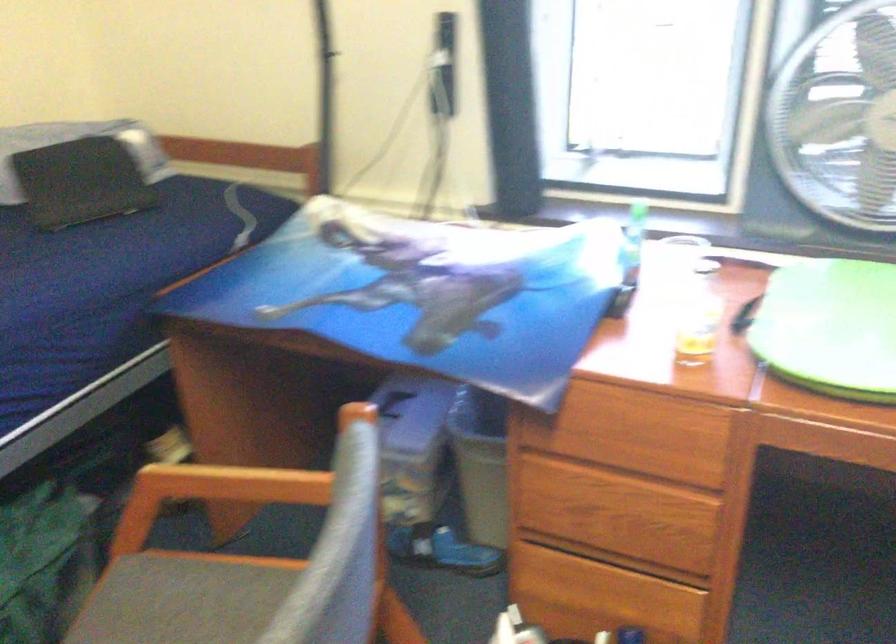
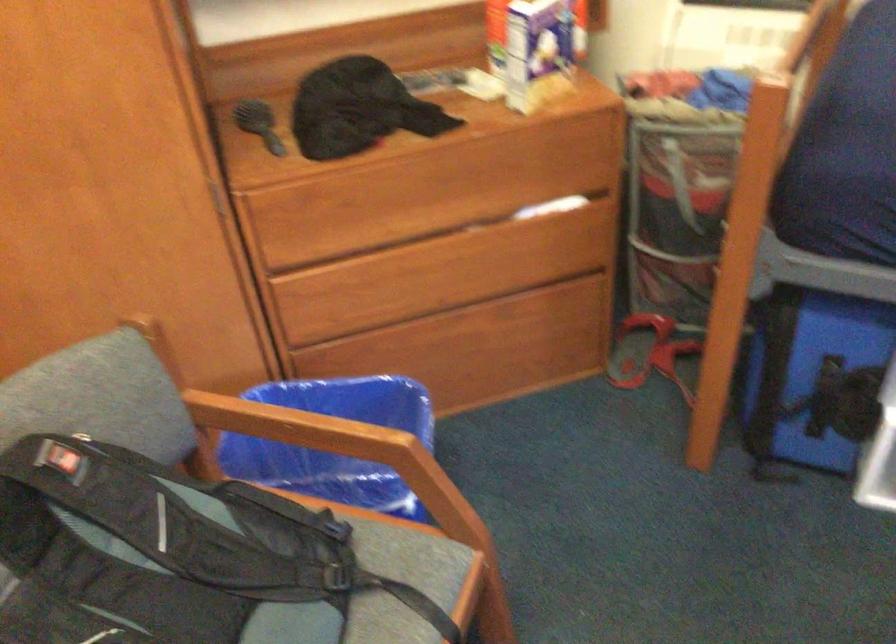
Looking at this image, how did the camera likely rotate?

The camera rotated toward left-down.